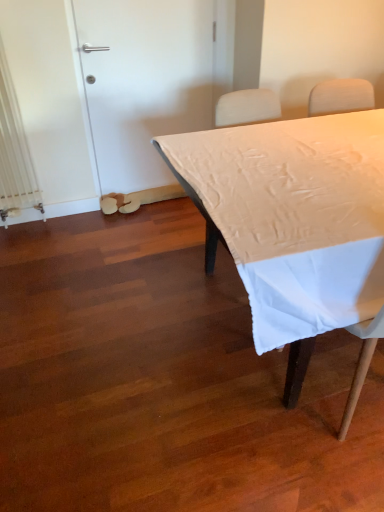
Question: Is white matte table at center directly adjacent to white matte door at upper left?

Choices:
 (A) no
 (B) yes

Answer: (A)

Question: Is white matte table at center at the right side of white matte door at upper left?

Choices:
 (A) yes
 (B) no

Answer: (A)

Question: Can you confirm if white matte table at center is taller than white matte door at upper left?

Choices:
 (A) no
 (B) yes

Answer: (A)

Question: Does white matte table at center have a larger size compared to white matte door at upper left?

Choices:
 (A) yes
 (B) no

Answer: (A)

Question: From the image's perspective, would you say white matte table at center is positioned over white matte door at upper left?

Choices:
 (A) yes
 (B) no

Answer: (B)

Question: Is white matte table at center shorter than white matte door at upper left?

Choices:
 (A) no
 (B) yes

Answer: (B)

Question: Considering the relative positions of white matte door at upper left and white matte table at center in the image provided, is white matte door at upper left to the right of white matte table at center from the viewer's perspective?

Choices:
 (A) yes
 (B) no

Answer: (B)

Question: Could you tell me if white matte door at upper left is facing white matte table at center?

Choices:
 (A) yes
 (B) no

Answer: (A)

Question: Is white matte door at upper left in front of white matte table at center?

Choices:
 (A) yes
 (B) no

Answer: (B)

Question: From the image's perspective, is white matte door at upper left beneath white matte table at center?

Choices:
 (A) no
 (B) yes

Answer: (A)

Question: From a real-world perspective, is white matte door at upper left on top of white matte table at center?

Choices:
 (A) yes
 (B) no

Answer: (A)

Question: Does white matte door at upper left have a greater height compared to white matte table at center?

Choices:
 (A) no
 (B) yes

Answer: (B)

Question: Considering their positions, is white matte door at upper left located in front of or behind white matte table at center?

Choices:
 (A) front
 (B) behind

Answer: (B)